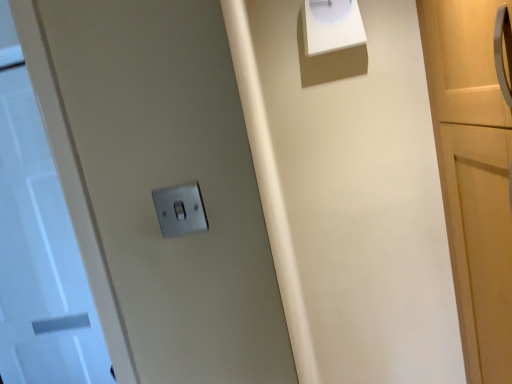
Question: Does metallic silver light switch at center have a lesser height compared to white glossy clock at upper center?

Choices:
 (A) no
 (B) yes

Answer: (B)

Question: From a real-world perspective, is metallic silver light switch at center on white glossy clock at upper center?

Choices:
 (A) yes
 (B) no

Answer: (B)

Question: Is the position of metallic silver light switch at center less distant than that of white glossy clock at upper center?

Choices:
 (A) no
 (B) yes

Answer: (B)

Question: Is white glossy clock at upper center a part of metallic silver light switch at center?

Choices:
 (A) yes
 (B) no

Answer: (B)

Question: Is metallic silver light switch at center at the left side of white glossy clock at upper center?

Choices:
 (A) no
 (B) yes

Answer: (B)

Question: Is metallic silver light switch at center facing away from white glossy clock at upper center?

Choices:
 (A) no
 (B) yes

Answer: (A)

Question: Is white glossy door at left looking in the opposite direction of metallic silver light switch at center?

Choices:
 (A) yes
 (B) no

Answer: (B)

Question: Can you confirm if white glossy door at left is smaller than metallic silver light switch at center?

Choices:
 (A) yes
 (B) no

Answer: (B)

Question: Considering the relative sizes of white glossy door at left and metallic silver light switch at center in the image provided, is white glossy door at left taller than metallic silver light switch at center?

Choices:
 (A) yes
 (B) no

Answer: (A)

Question: Considering the relative sizes of white glossy door at left and metallic silver light switch at center in the image provided, is white glossy door at left shorter than metallic silver light switch at center?

Choices:
 (A) no
 (B) yes

Answer: (A)

Question: From a real-world perspective, is white glossy door at left positioned over metallic silver light switch at center based on gravity?

Choices:
 (A) yes
 (B) no

Answer: (B)

Question: Considering the relative positions of white glossy door at left and metallic silver light switch at center in the image provided, is white glossy door at left in front of metallic silver light switch at center?

Choices:
 (A) no
 (B) yes

Answer: (A)

Question: Are white glossy clock at upper center and white glossy door at left beside each other?

Choices:
 (A) no
 (B) yes

Answer: (A)